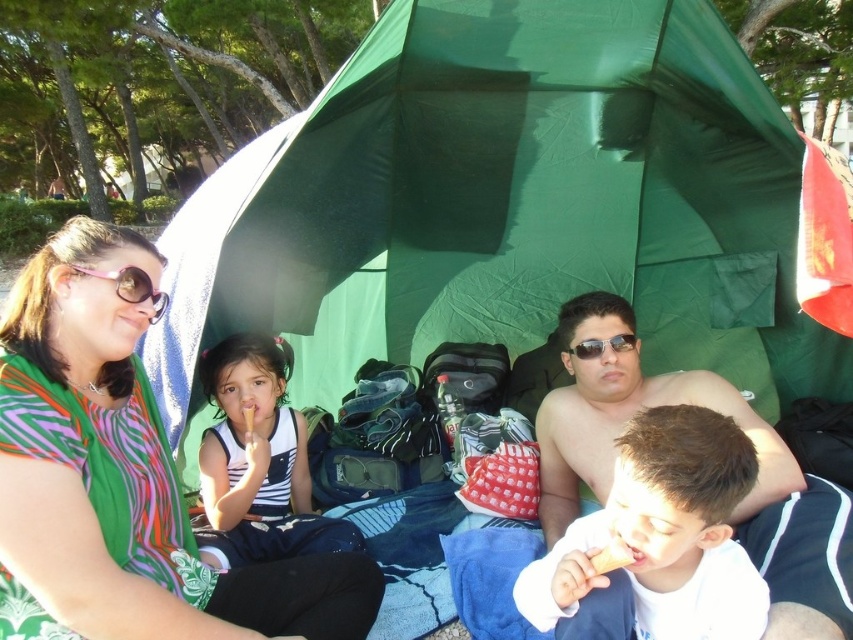
From the picture: What is the exact location of the printed fabric scarf at upper left in the image?

The printed fabric scarf at upper left is located at point (122, 480).

You are standing in front of the tent and see the striped fabric dress at center and the sunglasses at center. Which one is positioned to the left?

The striped fabric dress at center is positioned to the left of the sunglasses at center.

You are a photographer trying to capture a clear shot of the sunglasses at center and the printed fabric scarf at upper left. Since the scarf is partially blocking the view of the sunglasses, which object should you adjust to get a better shot?

The printed fabric scarf at upper left is taller than sunglasses at center, so you should adjust the printed fabric scarf at upper left to move it out of the way to get a clearer view of the sunglasses at center.